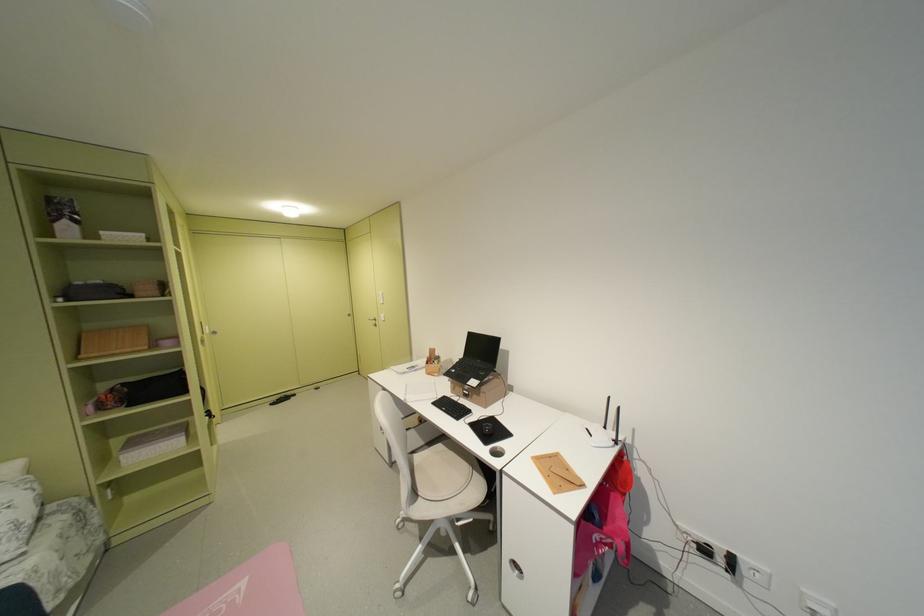
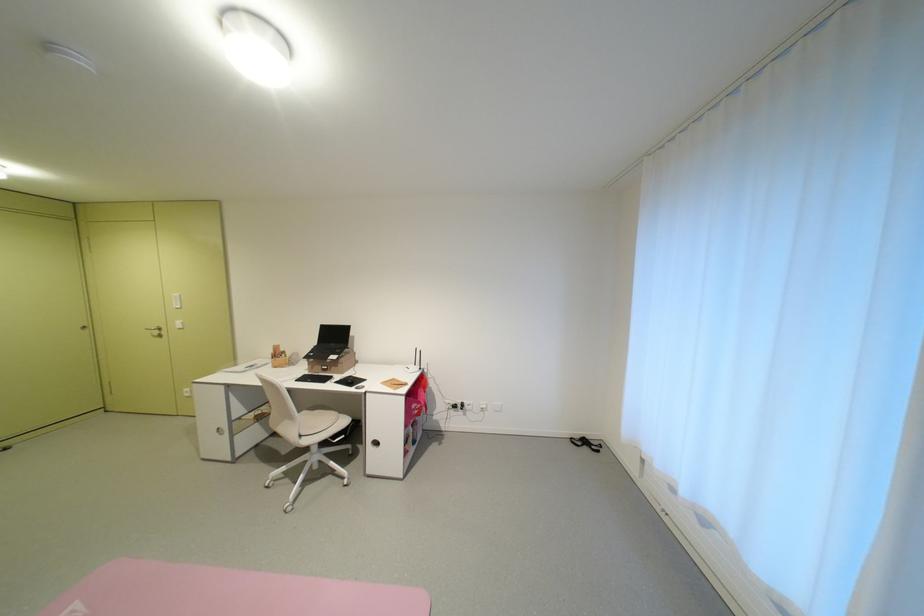
Find the pixel in the second image that matches (612,540) in the first image.

(424, 408)